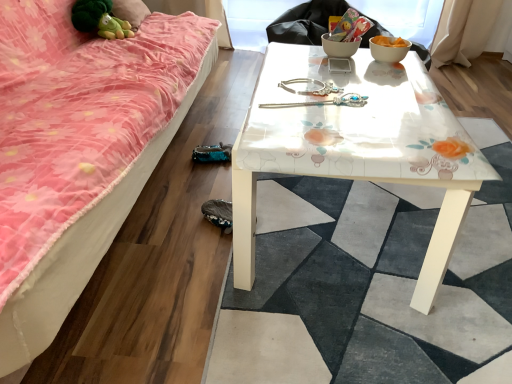
Question: From the image's perspective, is silver metallic hairpin at center located above or below white glossy table at center?

Choices:
 (A) above
 (B) below

Answer: (A)

Question: In terms of height, does silver metallic hairpin at center look taller or shorter compared to white glossy table at center?

Choices:
 (A) tall
 (B) short

Answer: (B)

Question: Considering the real-world distances, which object is closest to the white glossy table at center?

Choices:
 (A) white glossy bowl at upper right
 (B) pink fabric studio couch at lower left
 (C) silver metallic hairpin at center
 (D) green plush toy at upper left

Answer: (C)

Question: Which is farther from the silver metallic hairpin at center?

Choices:
 (A) white glossy bowl at upper right
 (B) white glossy table at center
 (C) green plush toy at upper left
 (D) pink fabric studio couch at lower left

Answer: (C)